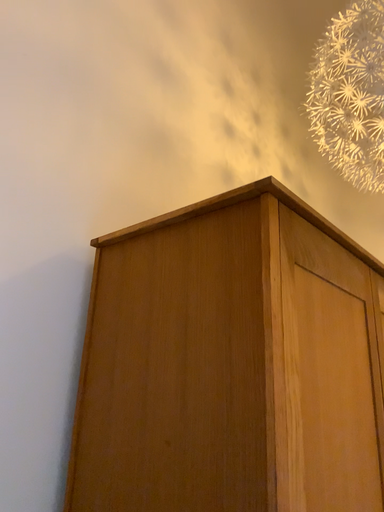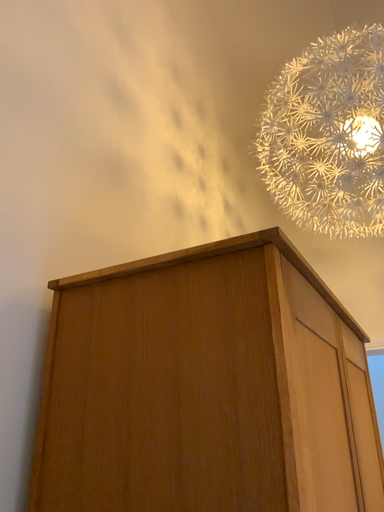
Question: How did the camera likely rotate when shooting the video?

Choices:
 (A) rotated left
 (B) rotated right

Answer: (B)